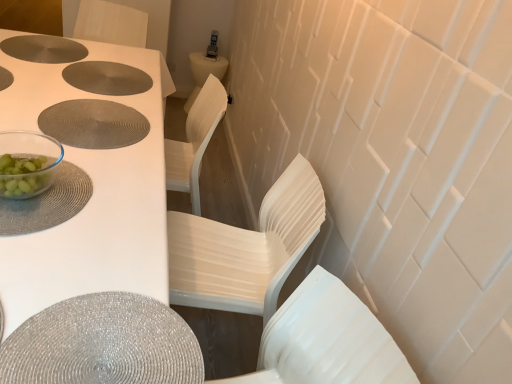
Where is `vacant area that lies between matte silver placemat at center, which ranks as the first hole in bottom-to-top order, and matte gray placemat at upper left, placed as the 3th hole when sorted from bottom to top`? vacant area that lies between matte silver placemat at center, which ranks as the first hole in bottom-to-top order, and matte gray placemat at upper left, placed as the 3th hole when sorted from bottom to top is located at coordinates (69, 81).